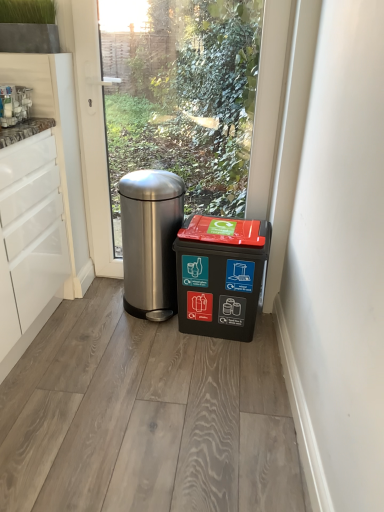
At what (x,y) coordinates should I click in order to perform the action: click on free location in front of black plastic recycling bin at lower right, which appears as the second waste container when viewed from the left. Please return your answer as a coordinate pair (x, y). The width and height of the screenshot is (384, 512). Looking at the image, I should click on (213, 362).